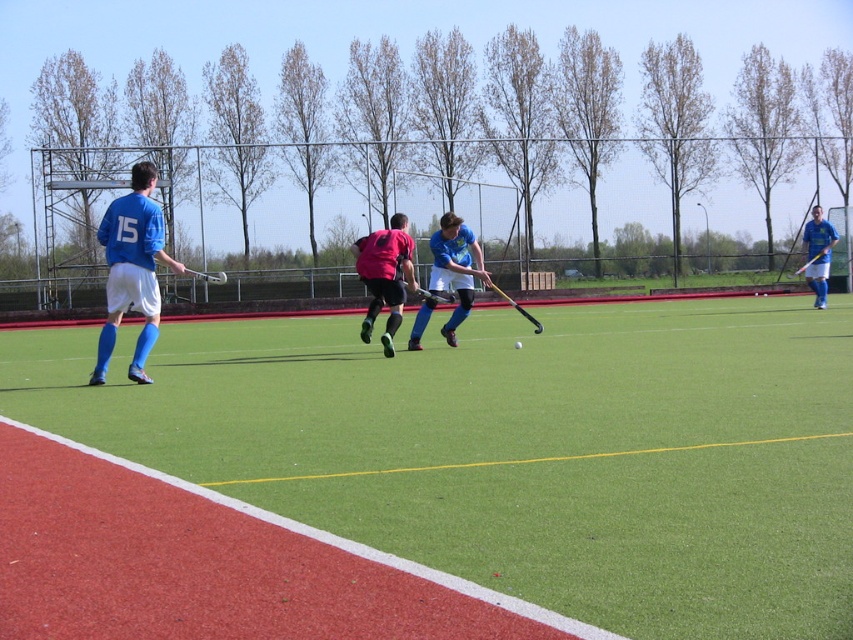
Question: Which object is the farthest from the green artificial turf at center?

Choices:
 (A) matte blue jersey at left
 (B) matte blue hockey stick at center
 (C) matte blue shirt at right

Answer: (C)

Question: Estimate the real-world distances between objects in this image. Which object is farther from the matte blue jersey at left?

Choices:
 (A) matte blue hockey stick at center
 (B) matte blue shirt at right
 (C) green artificial turf at center

Answer: (B)

Question: Does matte blue jersey at left appear on the left side of matte blue hockey stick at center?

Choices:
 (A) no
 (B) yes

Answer: (B)

Question: Which point is farther to the camera?

Choices:
 (A) green artificial turf at center
 (B) matte pink jersey at center
 (C) matte blue jersey at left
 (D) matte blue hockey stick at center

Answer: (D)

Question: Is green artificial turf at center to the left of matte pink jersey at center from the viewer's perspective?

Choices:
 (A) yes
 (B) no

Answer: (A)

Question: In this image, where is green artificial turf at center located relative to matte pink jersey at center?

Choices:
 (A) left
 (B) right

Answer: (A)